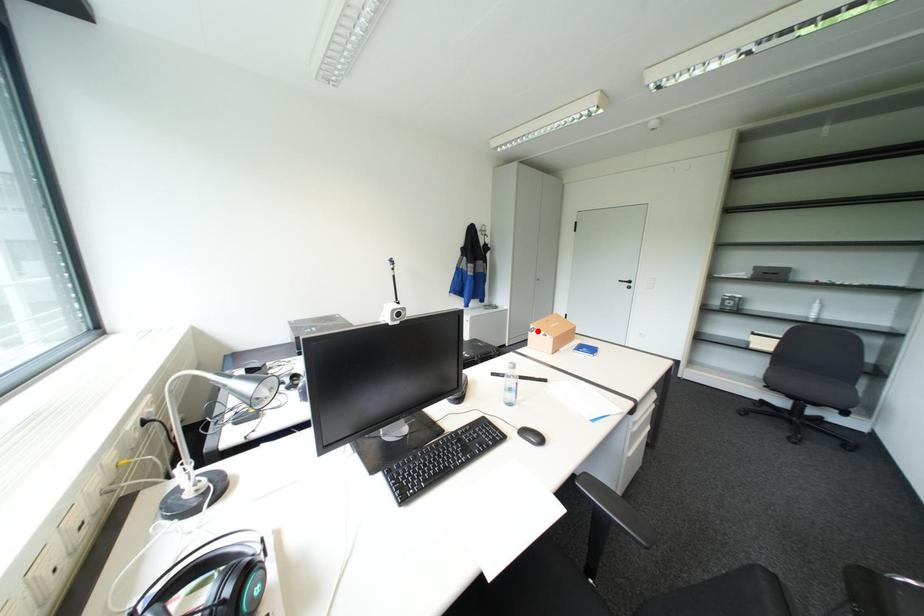
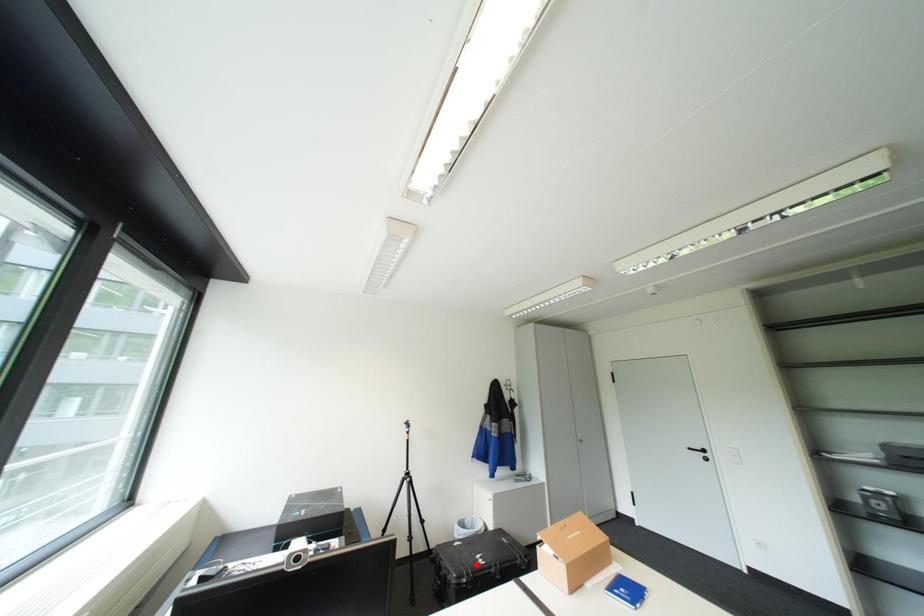
I am providing you with two images of the same scene from different viewpoints. A red point is marked on the first image and another point is marked on the second image. Is the red point in image1 aligned with the point shown in image2?

No